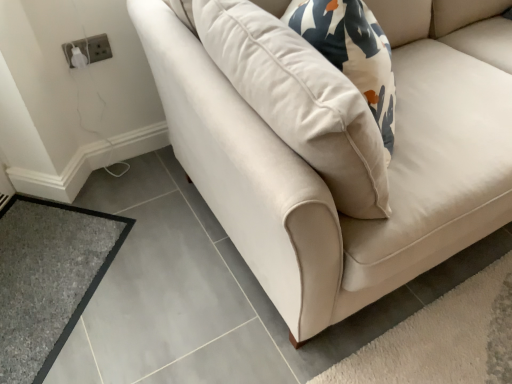
Question: Is gray carpet at lower left positioned with its back to white plastic socket at upper left?

Choices:
 (A) yes
 (B) no

Answer: (B)

Question: Considering the relative positions of gray carpet at lower left and white plastic socket at upper left in the image provided, is gray carpet at lower left to the right of white plastic socket at upper left from the viewer's perspective?

Choices:
 (A) no
 (B) yes

Answer: (A)

Question: Does gray carpet at lower left have a larger size compared to white plastic socket at upper left?

Choices:
 (A) yes
 (B) no

Answer: (A)

Question: From the image's perspective, is gray carpet at lower left located above white plastic socket at upper left?

Choices:
 (A) yes
 (B) no

Answer: (B)

Question: Is gray carpet at lower left facing towards white plastic socket at upper left?

Choices:
 (A) no
 (B) yes

Answer: (A)

Question: Can you confirm if gray carpet at lower left is wider than white plastic socket at upper left?

Choices:
 (A) no
 (B) yes

Answer: (B)

Question: Is white plastic socket at upper left positioned with its back to gray carpet at lower left?

Choices:
 (A) yes
 (B) no

Answer: (B)

Question: Can we say white plastic socket at upper left lies outside gray carpet at lower left?

Choices:
 (A) no
 (B) yes

Answer: (B)

Question: From the image's perspective, does white plastic socket at upper left appear lower than gray carpet at lower left?

Choices:
 (A) no
 (B) yes

Answer: (A)

Question: Is white plastic socket at upper left at the right side of gray carpet at lower left?

Choices:
 (A) no
 (B) yes

Answer: (B)

Question: From the image's perspective, is white plastic socket at upper left on top of gray carpet at lower left?

Choices:
 (A) yes
 (B) no

Answer: (A)

Question: Is white plastic socket at upper left bigger than gray carpet at lower left?

Choices:
 (A) yes
 (B) no

Answer: (B)

Question: In the image, is gray carpet at lower left on the left side or the right side of white plastic socket at upper left?

Choices:
 (A) right
 (B) left

Answer: (B)